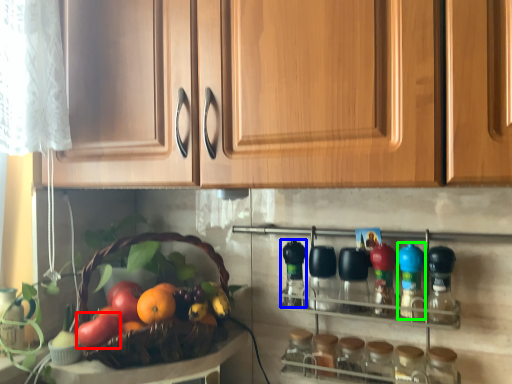
Question: Estimate the real-world distances between objects in this image. Which object is closer to apple (highlighted by a red box), bottle (highlighted by a blue box) or bottle (highlighted by a green box)?

Choices:
 (A) bottle
 (B) bottle

Answer: (A)